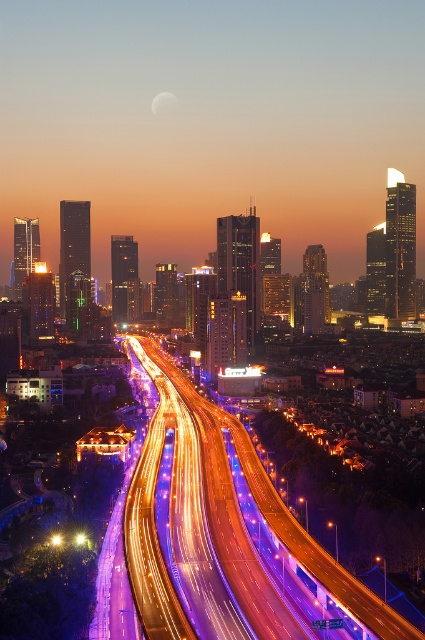
Question: Is purple light trails at center thinner than silvery reflective moon at upper center?

Choices:
 (A) no
 (B) yes

Answer: (A)

Question: Among these objects, which one is farthest from the camera?

Choices:
 (A) silvery reflective moon at upper center
 (B) purple light trails at center

Answer: (A)

Question: Is the position of purple light trails at center less distant than that of silvery reflective moon at upper center?

Choices:
 (A) no
 (B) yes

Answer: (B)

Question: Does purple light trails at center have a larger size compared to silvery reflective moon at upper center?

Choices:
 (A) no
 (B) yes

Answer: (B)